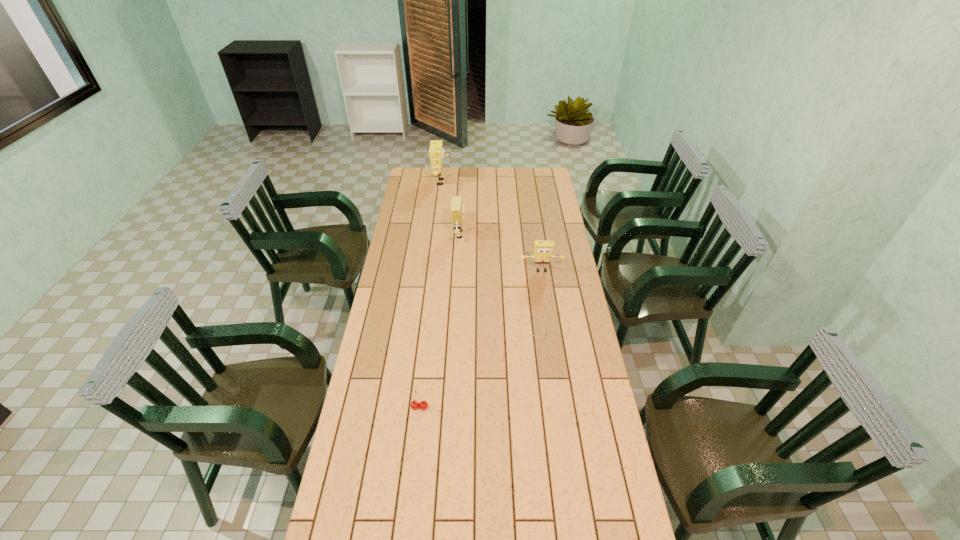
Locate an element on the screen. the second closest object relative to the rightmost object is located at coordinates (436, 152).

Identify the location of object that stands as the closest to the nearest sponge. The height and width of the screenshot is (540, 960). (457, 206).

Identify the location of sponge identified as the second closest to the rightmost sponge. (436, 152).

Select which sponge is the second closest to the leftmost sponge. Please provide its 2D coordinates. Your answer should be formatted as a tuple, i.e. [(x, y)], where the tuple contains the x and y coordinates of a point satisfying the conditions above.

[(543, 250)]

Where is `free spot that satisfies the following two spatial constraints: 1. on the face of the second nearest sponge; 2. with the stems of the nearest object pointing upwards`? free spot that satisfies the following two spatial constraints: 1. on the face of the second nearest sponge; 2. with the stems of the nearest object pointing upwards is located at coordinates (452, 407).